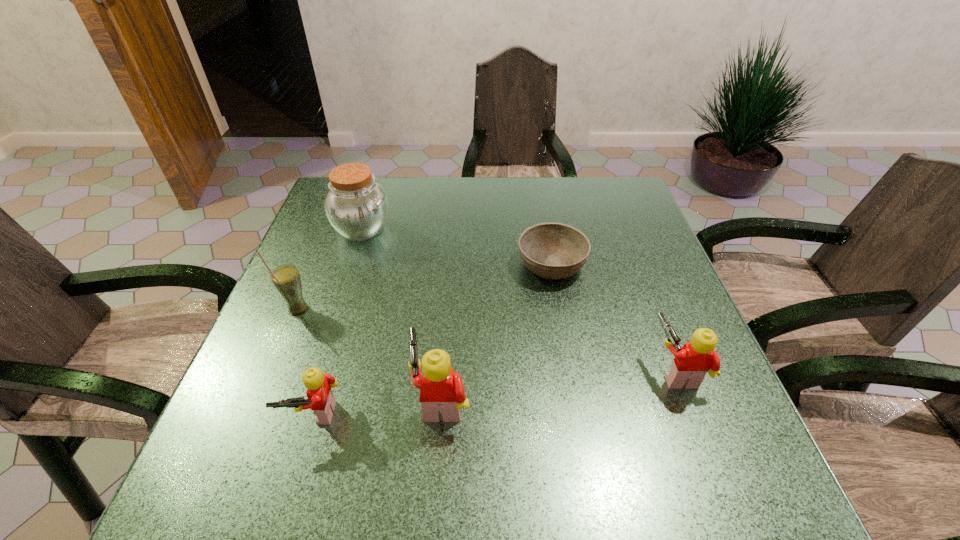
Please mark a free spot for a new Lego to balance the arrangement. Please provide its 2D coordinates. Your answer should be formatted as a tuple, i.e. [(x, y)], where the tuple contains the x and y coordinates of a point satisfying the conditions above.

[(562, 384)]